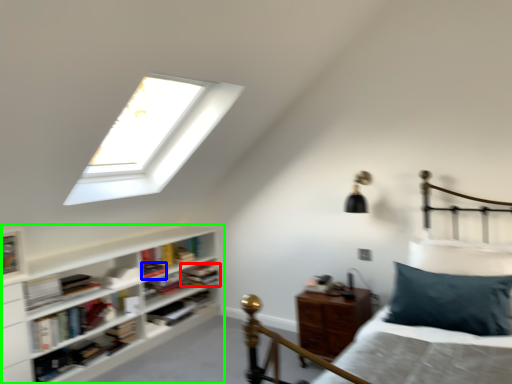
Question: Which is farther away from book (highlighted by a red box)? book (highlighted by a blue box) or shelf (highlighted by a green box)?

Choices:
 (A) book
 (B) shelf

Answer: (B)